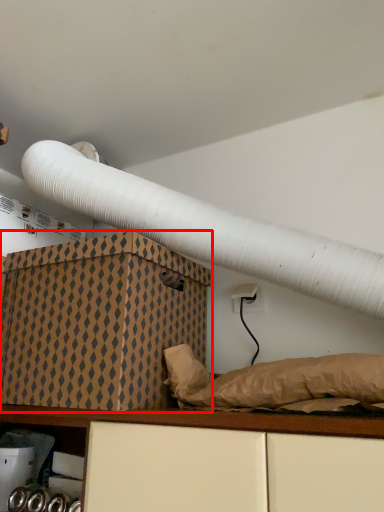
Question: From the image's perspective, where is box (annotated by the red box) located in relation to shelf in the image?

Choices:
 (A) below
 (B) above

Answer: (B)